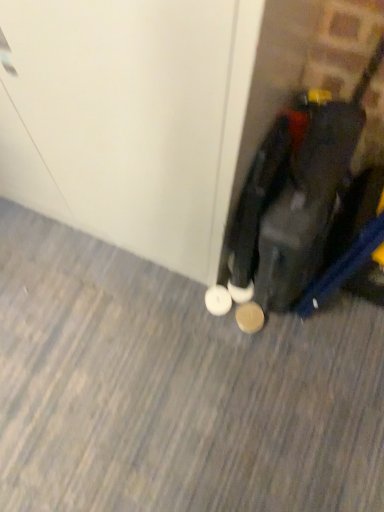
Find the location of `white glossy door at center`. white glossy door at center is located at coordinates (128, 118).

Locate an element on the screen. matte black suitcase at lower right is located at coordinates (316, 204).

Is white glossy door at center aimed at matte black suitcase at lower right?

No, white glossy door at center is not turned towards matte black suitcase at lower right.

Which is closer, (214,144) or (323,97)?

Positioned in front is point (214,144).

Is white glossy door at center surrounding matte black suitcase at lower right?

No, matte black suitcase at lower right is not a part of white glossy door at center.

Considering the points (306, 309) and (11, 156), which point is in front, point (306, 309) or point (11, 156)?

Point (11, 156)

I want to click on door above the matte black suitcase at lower right (from the image's perspective), so click(x=128, y=118).

Is matte black suitcase at lower right next to white glossy door at center?

There is a gap between matte black suitcase at lower right and white glossy door at center.

From a real-world perspective, is matte black suitcase at lower right above or below white glossy door at center?

matte black suitcase at lower right is situated lower than white glossy door at center in the real world.

From the image's perspective, which is above, matte black suitcase at lower right or brown suede shoe at lower right?

matte black suitcase at lower right.

Which object is positioned more to the right, matte black suitcase at lower right or brown suede shoe at lower right?

Positioned to the right is matte black suitcase at lower right.

I want to click on luggage lying above the brown suede shoe at lower right (from the image's perspective), so click(x=316, y=204).

Can you confirm if white glossy door at center is thinner than brown suede shoe at lower right?

In fact, white glossy door at center might be wider than brown suede shoe at lower right.

Would you say white glossy door at center contains brown suede shoe at lower right?

That's incorrect, brown suede shoe at lower right is not inside white glossy door at center.

In the scene shown: Considering the relative positions of white glossy door at center and brown suede shoe at lower right in the image provided, is white glossy door at center to the right of brown suede shoe at lower right from the viewer's perspective?

Incorrect, white glossy door at center is not on the right side of brown suede shoe at lower right.

Between white glossy door at center and brown suede shoe at lower right, which one has more height?

With more height is white glossy door at center.

Is brown suede shoe at lower right thinner than matte black suitcase at lower right?

Correct, the width of brown suede shoe at lower right is less than that of matte black suitcase at lower right.

From a real-world perspective, is brown suede shoe at lower right positioned over matte black suitcase at lower right based on gravity?

Incorrect, from a real-world perspective, brown suede shoe at lower right is lower than matte black suitcase at lower right.

Is brown suede shoe at lower right in front of or behind matte black suitcase at lower right in the image?

brown suede shoe at lower right is behind matte black suitcase at lower right.

From the image's perspective, which one is positioned higher, brown suede shoe at lower right or white glossy door at center?

white glossy door at center.

Measure the distance from brown suede shoe at lower right to white glossy door at center.

brown suede shoe at lower right is 22.47 inches away from white glossy door at center.

What's the angular difference between brown suede shoe at lower right and white glossy door at center's facing directions?

The facing directions of brown suede shoe at lower right and white glossy door at center are 2.38 degrees apart.

Which of these two, brown suede shoe at lower right or white glossy door at center, stands taller?

white glossy door at center is taller.

You are a GUI agent. You are given a task and a screenshot of the screen. Output one action in this format:
    pyautogui.click(x=<x>, y=<y>)
    Task: Click on the luggage to the right of white glossy door at center
    This screenshot has width=384, height=512.
    Given the screenshot: What is the action you would take?
    pyautogui.click(x=316, y=204)

At what (x,y) coordinates should I click in order to perform the action: click on door on the left of matte black suitcase at lower right. Please return your answer as a coordinate pair (x, y). Image resolution: width=384 pixels, height=512 pixels. Looking at the image, I should click on (128, 118).

When comparing their distances from matte black suitcase at lower right, does white glossy door at center or brown suede shoe at lower right seem further?

The object further to matte black suitcase at lower right is brown suede shoe at lower right.

Considering their positions, is brown suede shoe at lower right positioned closer to matte black suitcase at lower right than white glossy door at center?

The object closer to matte black suitcase at lower right is white glossy door at center.

From the image, which object appears to be nearer to brown suede shoe at lower right, white glossy door at center or matte black suitcase at lower right?

matte black suitcase at lower right.

Estimate the real-world distances between objects in this image. Which object is closer to brown suede shoe at lower right, matte black suitcase at lower right or white glossy door at center?

Among the two, matte black suitcase at lower right is located nearer to brown suede shoe at lower right.

Looking at the image, which one is located closer to white glossy door at center, matte black suitcase at lower right or brown suede shoe at lower right?

matte black suitcase at lower right.

From the image, which object appears to be nearer to white glossy door at center, brown suede shoe at lower right or matte black suitcase at lower right?

Among the two, matte black suitcase at lower right is located nearer to white glossy door at center.

The width and height of the screenshot is (384, 512). Identify the location of luggage located between white glossy door at center and brown suede shoe at lower right in the depth direction. (316, 204).